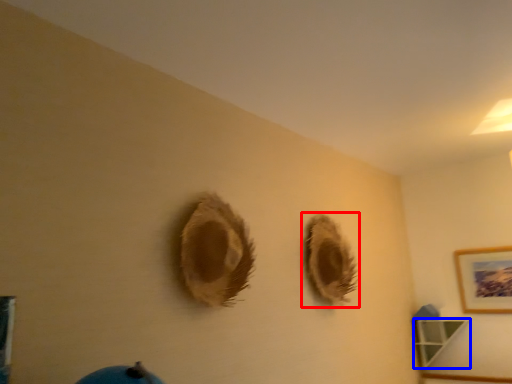
Question: Which point is further to the camera, hole (highlighted by a red box) or shelf (highlighted by a blue box)?

Choices:
 (A) hole
 (B) shelf

Answer: (B)